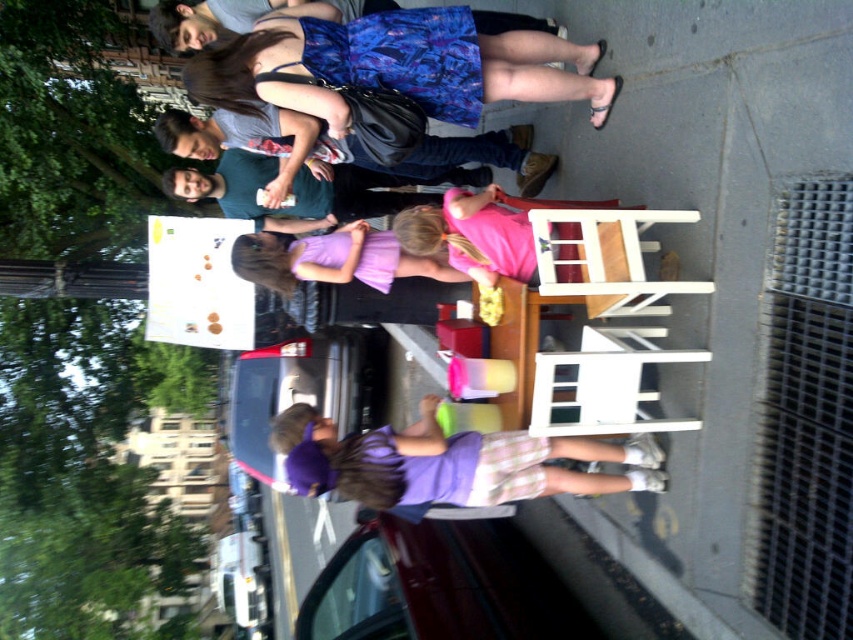
You are a photographer planning to take a group photo of the people at the fair. You have a camera with a 1.2 meter wide lens view. The printed fabric dress at upper center and the pink matte chair at center are in your frame. Can the entire width of both objects fit within the camera view?

The printed fabric dress at upper center might be wider than pink matte chair at center, so it is uncertain if the entire width of both objects can fit within the 1.2 meter wide lens view without overlapping or cropping.

You are organizing a small event and need to seat guests. You have a white wood chair at right and a purple fabric dress at center. Which object is narrower so it can fit through a narrow doorway?

The white wood chair at right is narrower than the purple fabric dress at center, so it can fit through the narrow doorway.

You are a person standing at the purple fabric dress at center, and you want to sit down on the white wood chair at right. Can you reach the chair without moving your feet?

The distance between the purple fabric dress at center and the white wood chair at right is 4.48 feet. Since the average person can reach about 2 feet in front of themselves without moving their feet, you would not be able to reach the chair.